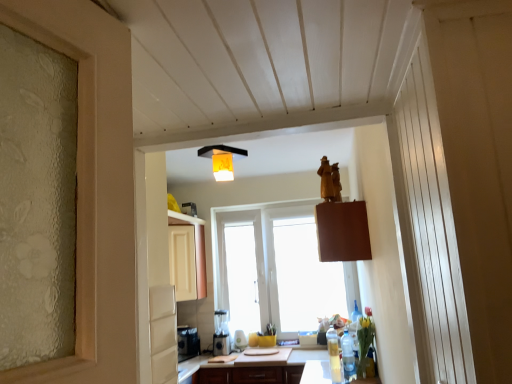
Question: Relative to white matte cabinet at upper left, is wooden statue at upper center in front or behind?

Choices:
 (A) front
 (B) behind

Answer: (A)

Question: Looking at the image, does wooden statue at upper center seem bigger or smaller compared to white matte cabinet at upper left?

Choices:
 (A) big
 (B) small

Answer: (B)

Question: Based on their relative distances, which object is nearer to the wooden statue at upper center?

Choices:
 (A) black plastic coffee machine at lower center
 (B) translucent plastic bottle at lower right, which is counted as the first bottle, starting from the back
 (C) clear plastic bottle at lower right, which ranks as the second bottle in back-to-front order
 (D) matte brown countertop at center
 (E) orange fabric lampshade at upper center

Answer: (A)

Question: Estimate the real-world distances between objects in this image. Which object is closer to the white matte cabinet at upper left?

Choices:
 (A) black plastic coffee machine at lower center
 (B) clear plastic bottle at lower right, acting as the 1th bottle starting from the front
 (C) translucent plastic bottle at lower right, which is counted as the first bottle, starting from the back
 (D) orange fabric lampshade at upper center
 (E) wooden statue at upper center

Answer: (E)